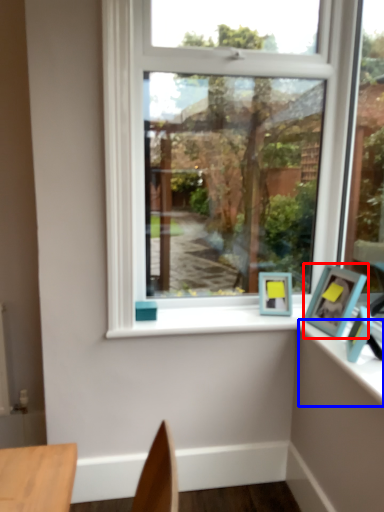
Question: Among these objects, which one is nearest to the camera, picture frame (highlighted by a red box) or counter top (highlighted by a blue box)?

Choices:
 (A) picture frame
 (B) counter top

Answer: (B)